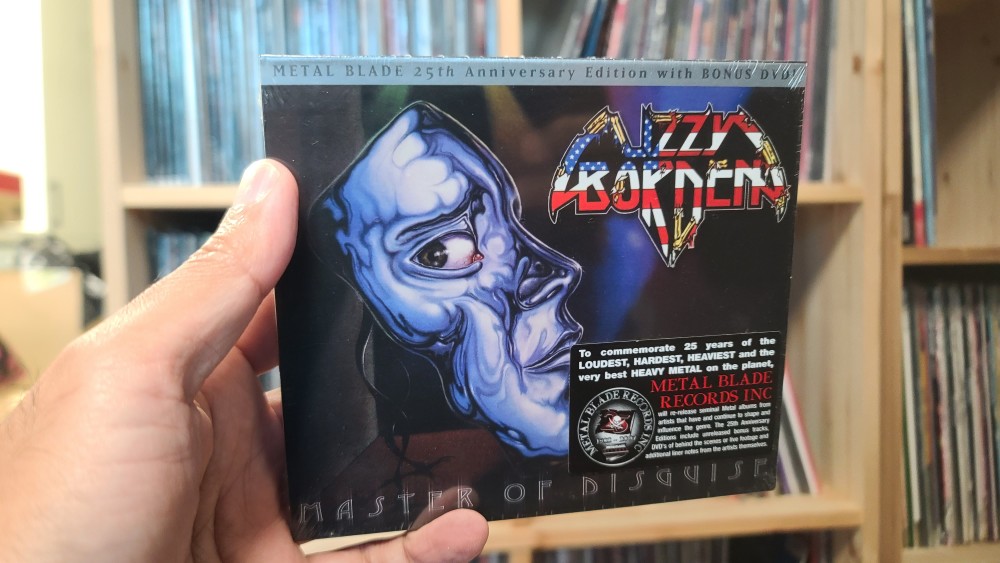
Locate an element on the screen. Image resolution: width=1000 pixels, height=563 pixels. shelf is located at coordinates [x=807, y=192], [x=783, y=517], [x=969, y=267], [x=966, y=552].